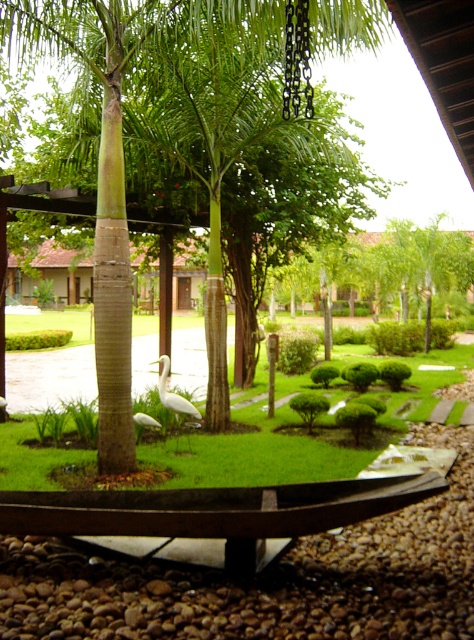
Based on the photo, you are a gardener looking at the garden scene. You see the green grass at center and the white matte bird at center. Which object is higher in the image?

The green grass at center is higher than the white matte bird at center in the image.